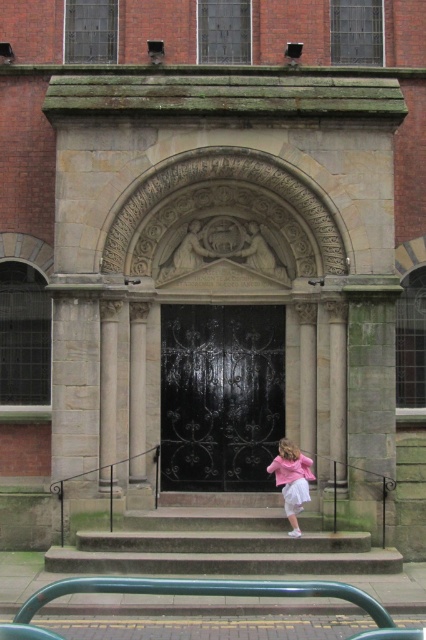
Question: Can you confirm if smooth stone stairs at center is positioned to the right of green painted metal rail at lower center?

Choices:
 (A) no
 (B) yes

Answer: (A)

Question: Which of the following is the closest to the observer?

Choices:
 (A) (406, 634)
 (B) (296, 458)
 (C) (301, 508)

Answer: (A)

Question: Estimate the real-world distances between objects in this image. Which object is farther from the white satin ballet skirt at lower center?

Choices:
 (A) pink satin dress at lower right
 (B) smooth stone stairs at center
 (C) green painted metal rail at lower center

Answer: (C)

Question: From the image, what is the correct spatial relationship of green painted metal rail at lower center in relation to pink satin dress at lower right?

Choices:
 (A) below
 (B) above

Answer: (A)

Question: Among these objects, which one is farthest from the camera?

Choices:
 (A) green painted metal rail at lower center
 (B) pink satin dress at lower right
 (C) white satin ballet skirt at lower center

Answer: (C)

Question: Where is green painted metal rail at lower center located in relation to pink satin dress at lower right in the image?

Choices:
 (A) left
 (B) right

Answer: (A)